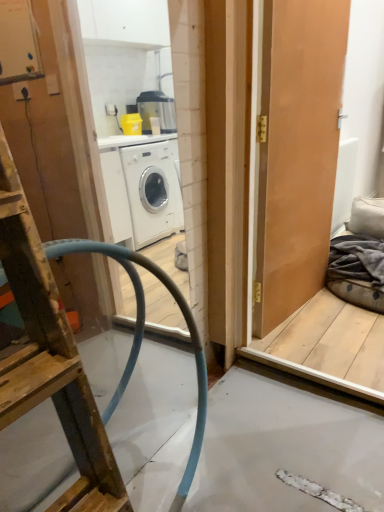
Question: Does matte wooden door at right have a smaller size compared to wooden ladder at left?

Choices:
 (A) yes
 (B) no

Answer: (A)

Question: From the image's perspective, does matte wooden door at right appear lower than wooden ladder at left?

Choices:
 (A) no
 (B) yes

Answer: (A)

Question: Are matte wooden door at right and wooden ladder at left making contact?

Choices:
 (A) yes
 (B) no

Answer: (B)

Question: Is matte wooden door at right at the right side of wooden ladder at left?

Choices:
 (A) no
 (B) yes

Answer: (B)

Question: Does matte wooden door at right turn towards wooden ladder at left?

Choices:
 (A) yes
 (B) no

Answer: (B)

Question: From the image's perspective, relative to matte wooden door at right, is dark grey fabric at right above or below?

Choices:
 (A) above
 (B) below

Answer: (B)

Question: In terms of height, does dark grey fabric at right look taller or shorter compared to matte wooden door at right?

Choices:
 (A) short
 (B) tall

Answer: (A)

Question: Is dark grey fabric at right spatially inside matte wooden door at right, or outside of it?

Choices:
 (A) inside
 (B) outside

Answer: (B)

Question: Relative to matte wooden door at right, is dark grey fabric at right in front or behind?

Choices:
 (A) behind
 (B) front

Answer: (A)

Question: Looking at their shapes, would you say wooden ladder at left is wider or thinner than dark grey fabric at right?

Choices:
 (A) wide
 (B) thin

Answer: (B)

Question: Is wooden ladder at left to the left or to the right of dark grey fabric at right in the image?

Choices:
 (A) left
 (B) right

Answer: (A)

Question: From a real-world perspective, is wooden ladder at left above or below dark grey fabric at right?

Choices:
 (A) below
 (B) above

Answer: (B)

Question: Is wooden ladder at left taller or shorter than dark grey fabric at right?

Choices:
 (A) short
 (B) tall

Answer: (B)

Question: Considering their positions, is dark grey fabric at right located in front of or behind wooden ladder at left?

Choices:
 (A) front
 (B) behind

Answer: (B)

Question: Would you say dark grey fabric at right is inside or outside wooden ladder at left?

Choices:
 (A) outside
 (B) inside

Answer: (A)